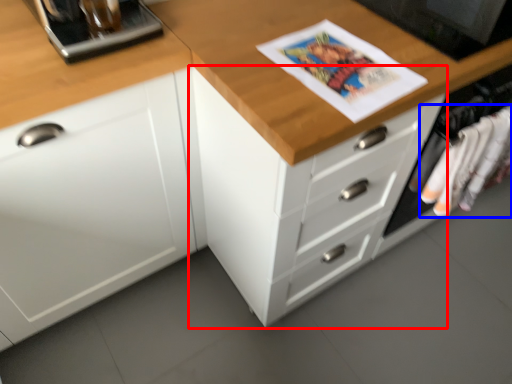
Question: Which point is closer to the camera, chest of drawers (highlighted by a red box) or clothing (highlighted by a blue box)?

Choices:
 (A) chest of drawers
 (B) clothing

Answer: (A)